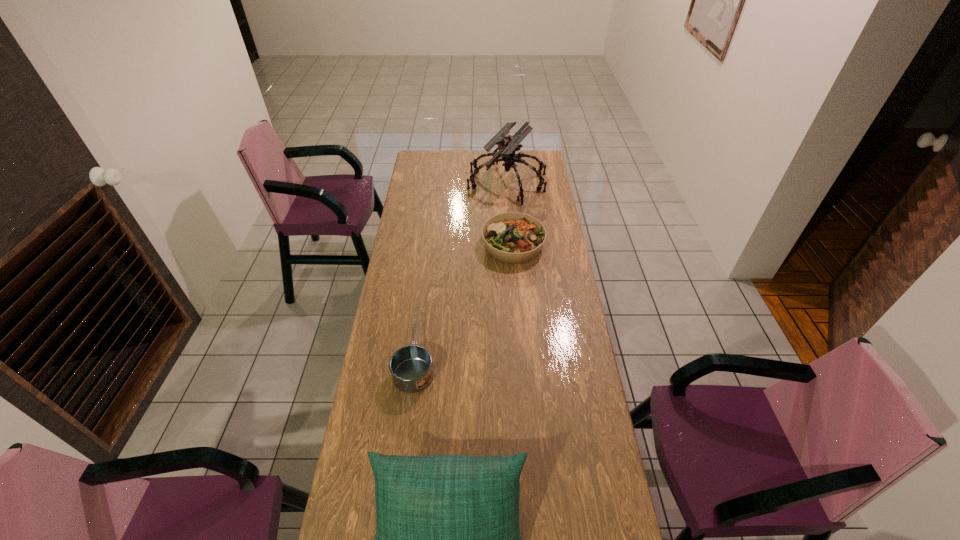
This screenshot has height=540, width=960. I want to click on drone, so click(507, 146).

This screenshot has height=540, width=960. I want to click on the third nearest object, so 511,237.

I want to click on saucepan, so click(411, 369).

The image size is (960, 540). What are the coordinates of `vacant area situated on the left of the farthest object` in the screenshot? It's located at (436, 181).

Locate an element on the screen. free space located 0.190m on the left of the second farthest object is located at coordinates (441, 245).

Locate an element on the screen. Image resolution: width=960 pixels, height=540 pixels. vacant space located with the handle extending from one side of the saucepan is located at coordinates coord(426,272).

This screenshot has width=960, height=540. I want to click on vacant space located with the handle extending from one side of the saucepan, so click(423, 295).

You are a GUI agent. You are given a task and a screenshot of the screen. Output one action in this format:
    pyautogui.click(x=<x>, y=<y>)
    Task: Click on the free space located with the handle extending from one side of the saucepan
    
    Given the screenshot: What is the action you would take?
    pyautogui.click(x=426, y=270)

Image resolution: width=960 pixels, height=540 pixels. Identify the location of object that is at the far edge. (507, 146).

The image size is (960, 540). Find the location of `object present at the left edge`. object present at the left edge is located at coordinates (411, 369).